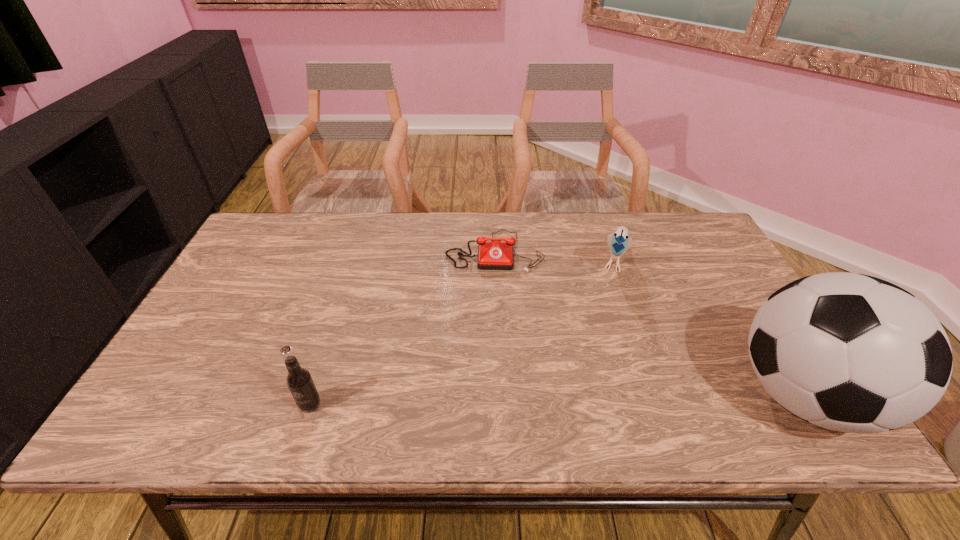
The width and height of the screenshot is (960, 540). I want to click on free space located on the dial of the telephone, so point(493,295).

The width and height of the screenshot is (960, 540). What are the coordinates of `vacant space located 0.160m on the dial of the telephone` in the screenshot? It's located at (492, 314).

This screenshot has height=540, width=960. Identify the location of blank space located 0.230m on the dial of the telephone. (492, 334).

You are a GUI agent. You are given a task and a screenshot of the screen. Output one action in this format:
    pyautogui.click(x=<x>, y=<y>)
    Task: Click on the bird positioned at the far edge
    
    Given the screenshot: What is the action you would take?
    pyautogui.click(x=619, y=242)

In order to click on telephone at the far edge in this screenshot , I will do `click(498, 255)`.

The height and width of the screenshot is (540, 960). In order to click on root beer that is at the near edge in this screenshot , I will do `click(300, 383)`.

Find the location of `soccer ball located at the near edge`. soccer ball located at the near edge is located at coordinates coord(848,352).

At what (x,y) coordinates should I click in order to perform the action: click on object that is at the right edge. Please return your answer as a coordinate pair (x, y). Looking at the image, I should click on (848, 352).

I want to click on object present at the near right corner, so click(848, 352).

Locate an element on the screen. This screenshot has height=540, width=960. vacant space at the far edge is located at coordinates (390, 234).